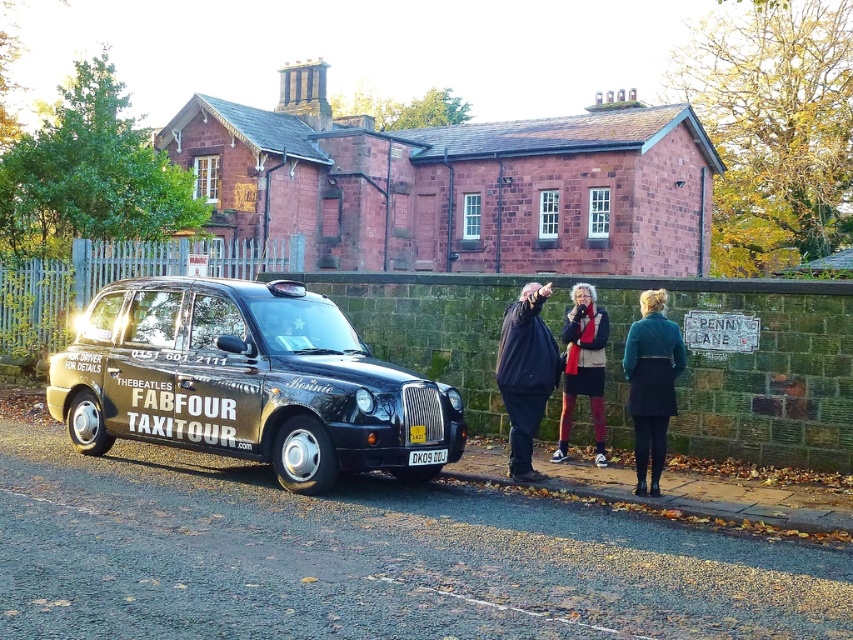
You are a tour guide leading a group near the Penny Lane sign. You notice a tourist wearing a teal wool coat at lower right and another tourist with a velvet red scarf at center. Your group wants to take a photo with both tourists. Can you position your group so that both tourists are in the frame without moving them? The camera has a 6.5 feet wide field of view.

The teal wool coat at lower right and velvet red scarf at center are 5.37 feet apart. Since the camera has a 6.5 feet wide field of view, which is wider than the distance between them, you can position your group so that both tourists are in the frame without moving them.